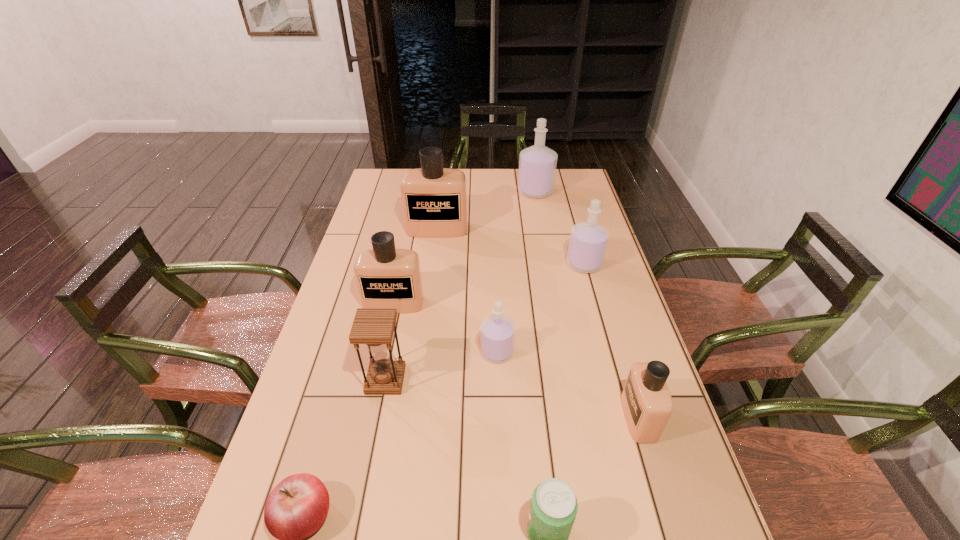
Identify the location of vacant region between the hourglass and the smallest purple perfume. Image resolution: width=960 pixels, height=540 pixels. [442, 366].

Locate an element on the screen. This screenshot has width=960, height=540. empty space between the eighth nearest object and the smallest beige perfume is located at coordinates (538, 323).

Where is `free space between the fourth farthest perfume and the second biggest purple perfume`? free space between the fourth farthest perfume and the second biggest purple perfume is located at coordinates (489, 284).

The height and width of the screenshot is (540, 960). I want to click on free space between the hourglass and the fifth nearest object, so click(x=442, y=366).

At what (x,y) coordinates should I click in order to perform the action: click on free spot between the farthest purple perfume and the third farthest object. Please return your answer as a coordinate pair (x, y). This screenshot has height=540, width=960. Looking at the image, I should click on (560, 228).

You are a GUI agent. You are given a task and a screenshot of the screen. Output one action in this format:
    pyautogui.click(x=<x>, y=<y>)
    Task: Click on the vacant space that's between the smallest purple perfume and the biggest beige perfume
    Image resolution: width=960 pixels, height=540 pixels.
    Given the screenshot: What is the action you would take?
    pyautogui.click(x=467, y=291)

The width and height of the screenshot is (960, 540). I want to click on empty location between the third farthest object and the biggest purple perfume, so click(560, 228).

Identify the location of vacant space in between the hourglass and the fifth nearest object. The height and width of the screenshot is (540, 960). (442, 366).

I want to click on object that ranks as the fourth closest to the nearest perfume, so click(x=374, y=327).

Identify the location of object that is the seventh closest to the second farthest perfume. This screenshot has width=960, height=540. (296, 508).